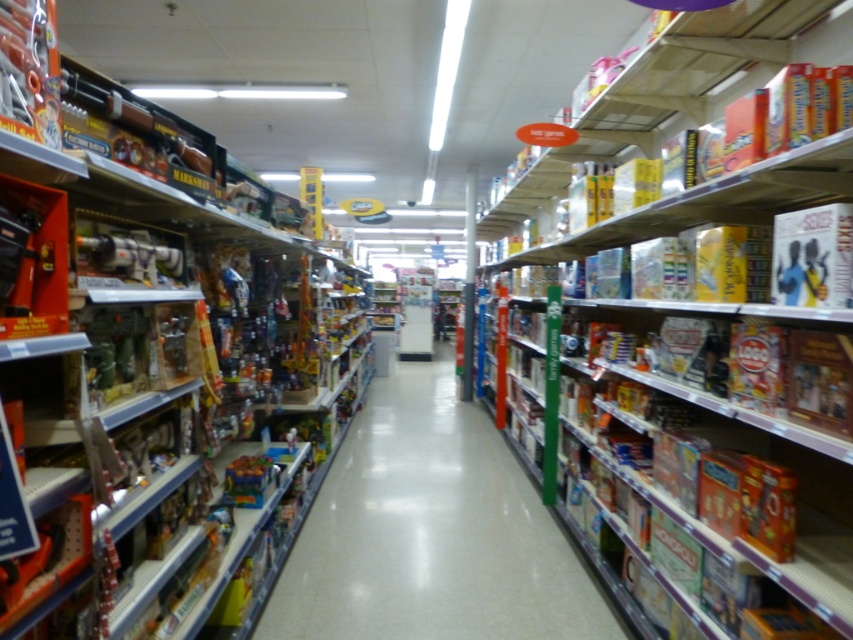
Which is more to the right, cardboard game box at upper right or matte plastic toys at center?

cardboard game box at upper right

Can you confirm if cardboard game box at upper right is positioned above matte plastic toys at center?

Indeed, cardboard game box at upper right is positioned over matte plastic toys at center.

This screenshot has height=640, width=853. I want to click on cardboard game box at upper right, so click(x=712, y=442).